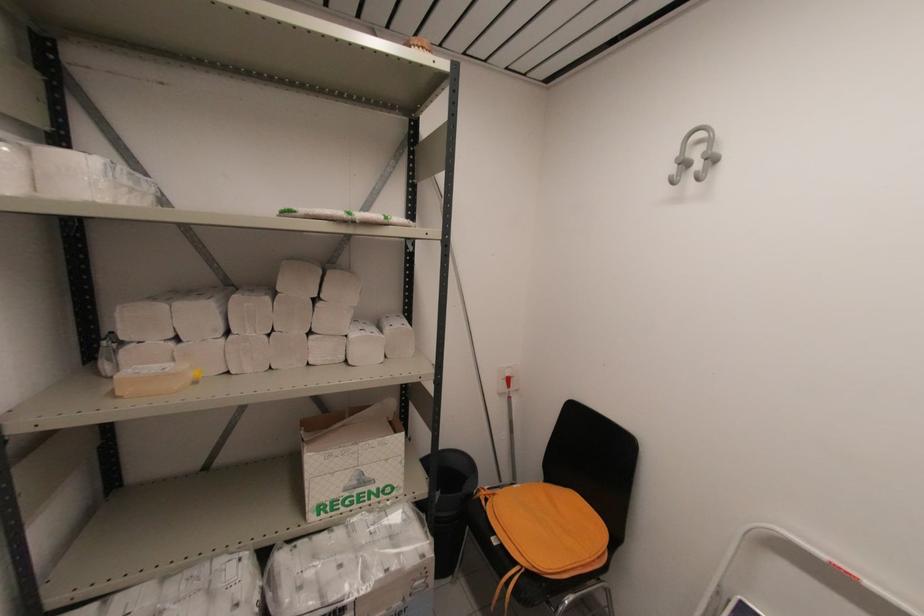
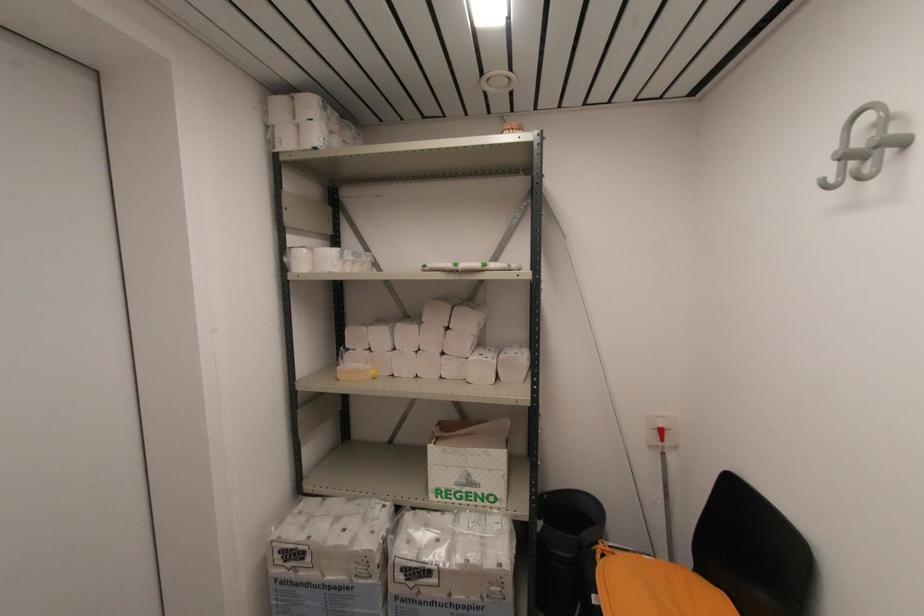
Find the pixel in the second image that matches point 495,495 in the first image.

(614, 554)